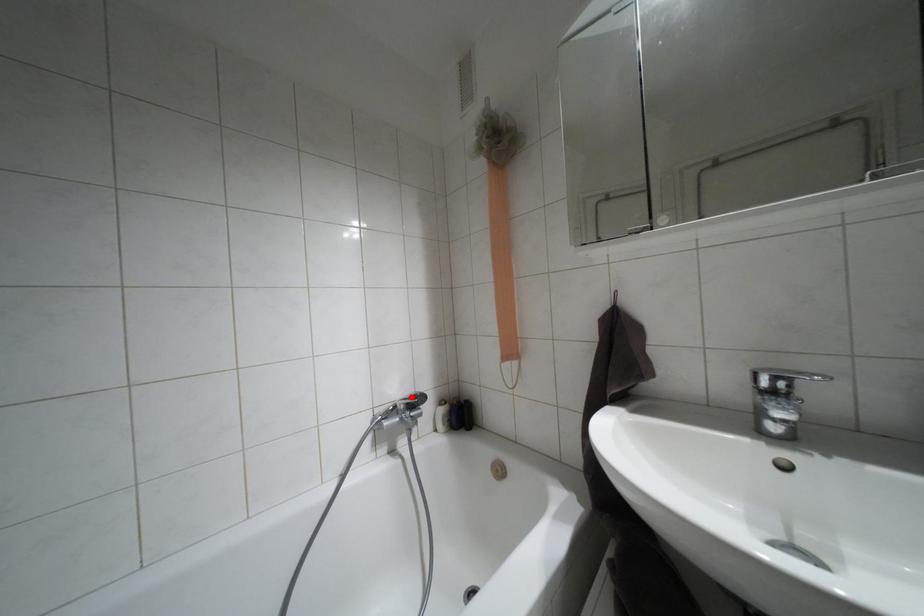
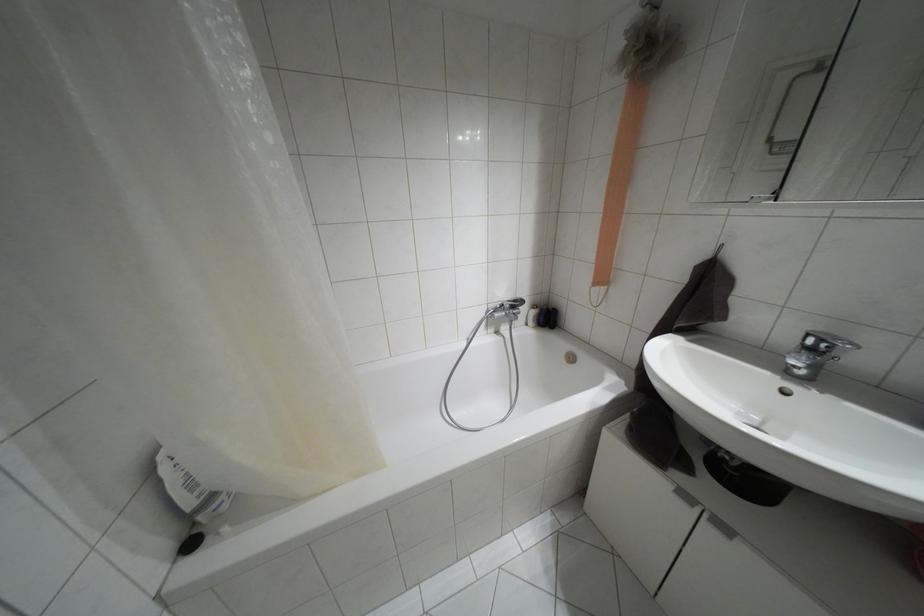
In the second image, find the point that corresponds to the highlighted location in the first image.

(514, 301)